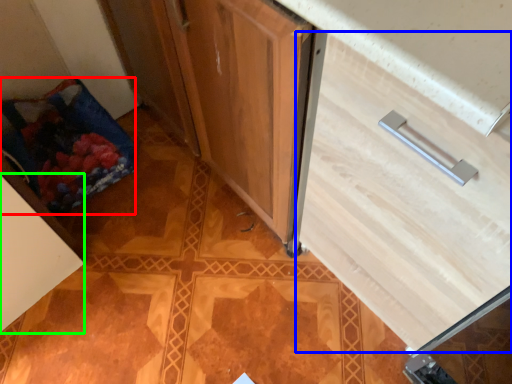
Question: Which is farther away from material (highlighted by a red box)? drawer (highlighted by a blue box) or cabinetry (highlighted by a green box)?

Choices:
 (A) drawer
 (B) cabinetry

Answer: (A)